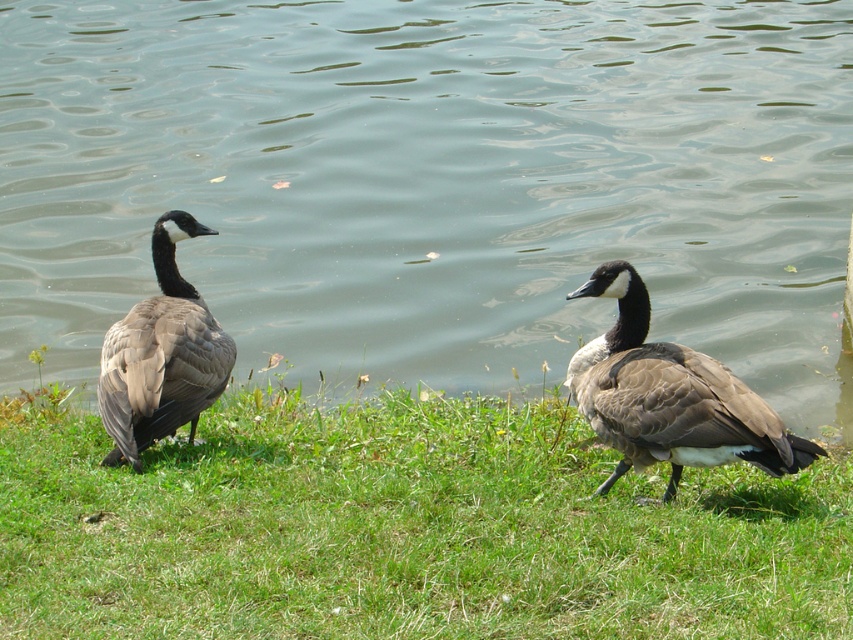
You are standing on the grassy bank and want to walk towards the brown matte duck at right. Which direction should you move relative to the greenish water at center?

You should move towards the right side away from the greenish water at center because the brown matte duck at right is positioned further away from the viewer compared to the greenish water at center.

You are a photographer trying to capture the greenish water at center in the image. Based on its 2D coordinates, which part of the image should you focus on?

The greenish water at center is located at the 2D coordinates point of (434, 182), so you should focus on the center area slightly to the left.